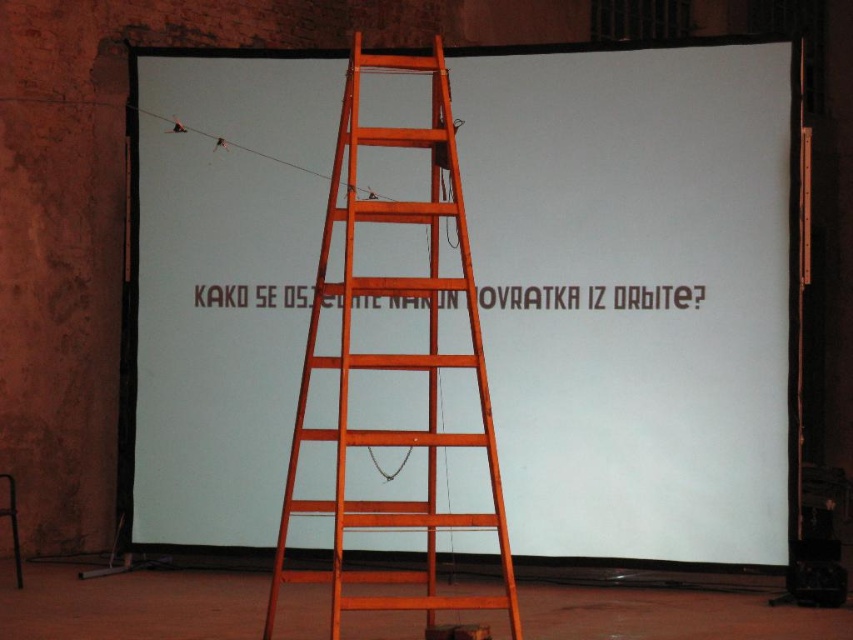
You are standing in front of the projection screen and want to reach the two points marked on the screen. Which point, point (239, 193) or point (387, 141), is closer to you?

Point (387, 141) is closer to you because it is in front of point (239, 193), which is behind it.

You are an astronaut preparing for a presentation about reentry experiences. You need to adjust the ladder to reach the top of the white matte projection screen at center. Given that the wooden ladder at center is currently 6.17 feet away from the screen, can you safely move the ladder closer to the screen to reach it?

The white matte projection screen at center and wooden ladder at center are 6.17 feet apart. To safely adjust the ladder, ensure it is placed at a safe distance from the screen, typically one quarter of its height, to maintain stability. Without knowing the ladder height, it is unclear if moving it closer would be safe. However, the current distance of 6.17 feet may be sufficient if the ladder is tall enough.